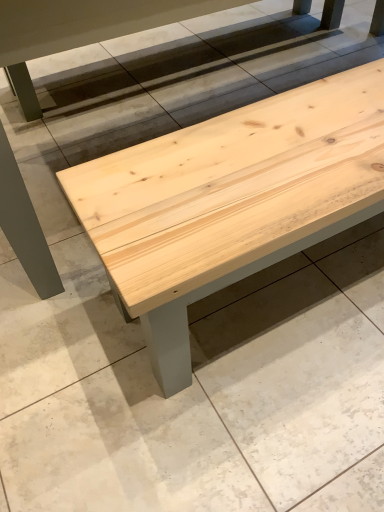
Question: Can you confirm if natural wood bench at center is smaller than natural wood bench at center?

Choices:
 (A) no
 (B) yes

Answer: (A)

Question: Does natural wood bench at center come in front of natural wood bench at center?

Choices:
 (A) yes
 (B) no

Answer: (A)

Question: Is natural wood bench at center taller than natural wood bench at center?

Choices:
 (A) no
 (B) yes

Answer: (B)

Question: Considering the relative sizes of natural wood bench at center and natural wood bench at center in the image provided, is natural wood bench at center shorter than natural wood bench at center?

Choices:
 (A) no
 (B) yes

Answer: (A)

Question: Is natural wood bench at center oriented away from natural wood bench at center?

Choices:
 (A) no
 (B) yes

Answer: (A)

Question: Can we say natural wood bench at center lies outside natural wood bench at center?

Choices:
 (A) no
 (B) yes

Answer: (B)

Question: Is the depth of natural wood bench at center greater than that of natural wood bench at center?

Choices:
 (A) no
 (B) yes

Answer: (B)

Question: Can you confirm if natural wood bench at center is wider than natural wood bench at center?

Choices:
 (A) yes
 (B) no

Answer: (A)

Question: Is natural wood bench at center at the back of natural wood bench at center?

Choices:
 (A) yes
 (B) no

Answer: (B)

Question: Can you confirm if natural wood bench at center is shorter than natural wood bench at center?

Choices:
 (A) no
 (B) yes

Answer: (B)

Question: Considering the relative sizes of natural wood bench at center and natural wood bench at center in the image provided, is natural wood bench at center thinner than natural wood bench at center?

Choices:
 (A) no
 (B) yes

Answer: (A)

Question: Can we say natural wood bench at center lies outside natural wood bench at center?

Choices:
 (A) yes
 (B) no

Answer: (A)

Question: Is natural wood bench at center bigger or smaller than natural wood bench at center?

Choices:
 (A) big
 (B) small

Answer: (A)